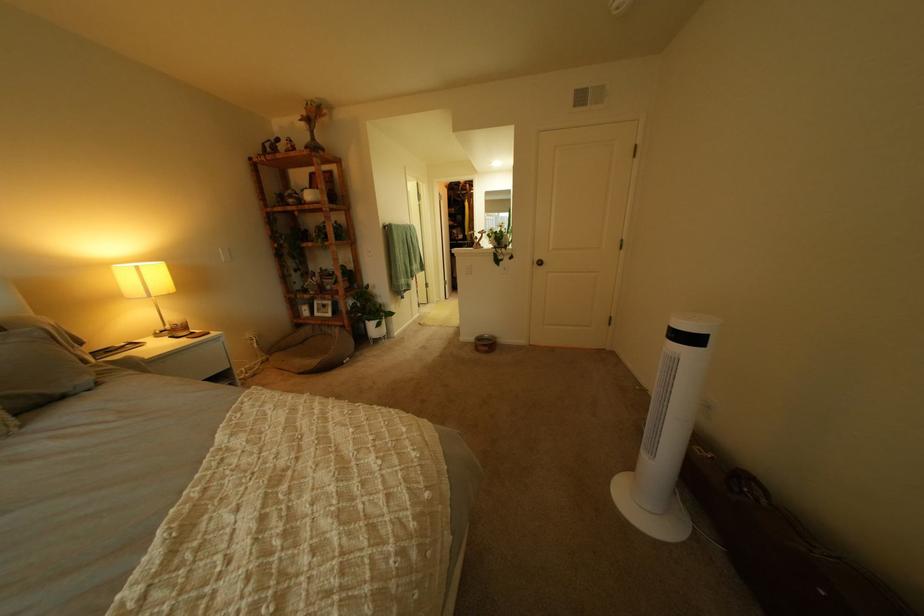
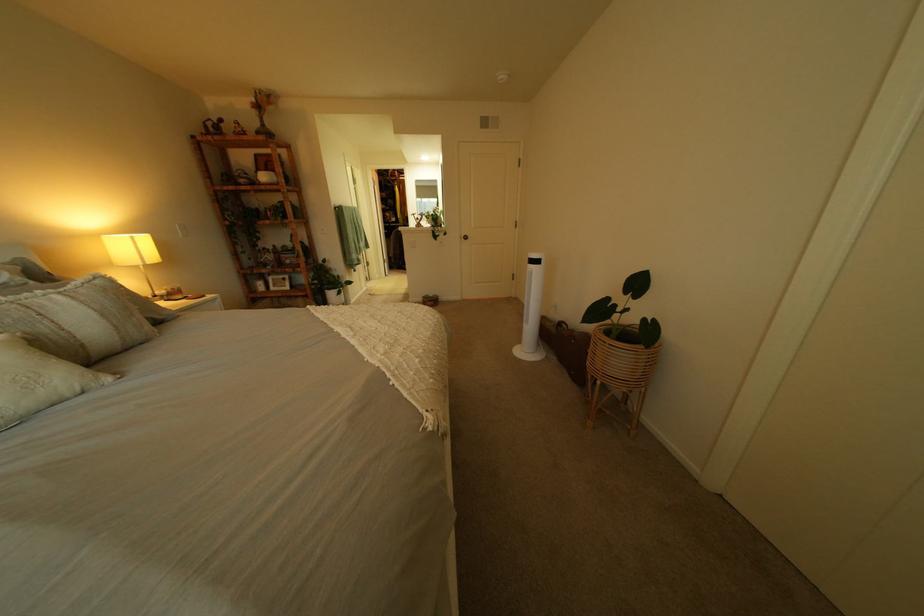
Question: Based on the continuous images, in which direction is the camera rotating? Reply with the corresponding letter.

Choices:
 (A) Left
 (B) Right
 (C) Up
 (D) Down

Answer: (B)